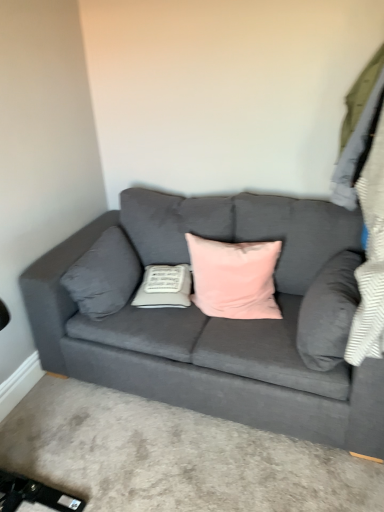
Question: Considering the relative positions of gray fabric pillow at left, the 4th pillow viewed from the right, and velvet gray pillow at right, marked as the first pillow in a right-to-left arrangement, in the image provided, is gray fabric pillow at left, the 4th pillow viewed from the right, to the right of velvet gray pillow at right, marked as the first pillow in a right-to-left arrangement, from the viewer's perspective?

Choices:
 (A) no
 (B) yes

Answer: (A)

Question: From a real-world perspective, is gray fabric pillow at left, the 4th pillow viewed from the right, positioned under velvet gray pillow at right, marked as the first pillow in a right-to-left arrangement, based on gravity?

Choices:
 (A) no
 (B) yes

Answer: (B)

Question: Considering the relative sizes of gray fabric pillow at left, the 4th pillow viewed from the right, and velvet gray pillow at right, the fourth pillow from the left, in the image provided, is gray fabric pillow at left, the 4th pillow viewed from the right, shorter than velvet gray pillow at right, the fourth pillow from the left,?

Choices:
 (A) yes
 (B) no

Answer: (A)

Question: From a real-world perspective, is gray fabric pillow at left, the 4th pillow viewed from the right, over velvet gray pillow at right, the fourth pillow from the left?

Choices:
 (A) no
 (B) yes

Answer: (A)

Question: From the image's perspective, does gray fabric pillow at left, marked as the 1th pillow in a left-to-right arrangement, appear higher than velvet gray pillow at right, marked as the first pillow in a right-to-left arrangement?

Choices:
 (A) no
 (B) yes

Answer: (B)

Question: In terms of width, does velvet gray pillow at right, the fourth pillow from the left, look wider or thinner when compared to velvet gray couch at center?

Choices:
 (A) thin
 (B) wide

Answer: (A)

Question: Considering the relative positions of velvet gray pillow at right, marked as the first pillow in a right-to-left arrangement, and velvet gray couch at center in the image provided, is velvet gray pillow at right, marked as the first pillow in a right-to-left arrangement, to the left or to the right of velvet gray couch at center?

Choices:
 (A) left
 (B) right

Answer: (B)

Question: From their relative heights in the image, would you say velvet gray pillow at right, the fourth pillow from the left, is taller or shorter than velvet gray couch at center?

Choices:
 (A) short
 (B) tall

Answer: (A)

Question: Based on their sizes in the image, would you say velvet gray pillow at right, the fourth pillow from the left, is bigger or smaller than velvet gray couch at center?

Choices:
 (A) small
 (B) big

Answer: (A)

Question: Is velvet gray couch at center spatially inside velvet gray pillow at right, marked as the first pillow in a right-to-left arrangement, or outside of it?

Choices:
 (A) inside
 (B) outside

Answer: (B)

Question: From the image's perspective, is velvet gray couch at center located above or below velvet gray pillow at right, the fourth pillow from the left?

Choices:
 (A) above
 (B) below

Answer: (A)

Question: Is velvet gray couch at center to the left or to the right of velvet gray pillow at right, marked as the first pillow in a right-to-left arrangement, in the image?

Choices:
 (A) right
 (B) left

Answer: (B)

Question: Relative to velvet gray pillow at right, marked as the first pillow in a right-to-left arrangement, is velvet gray couch at center in front or behind?

Choices:
 (A) behind
 (B) front

Answer: (B)

Question: In terms of size, does gray fabric pillow at left, the 4th pillow viewed from the right, appear bigger or smaller than pink velvet pillow at center, placed as the 2th pillow when sorted from right to left?

Choices:
 (A) small
 (B) big

Answer: (A)

Question: From a real-world perspective, relative to pink velvet pillow at center, placed as the 2th pillow when sorted from right to left, is gray fabric pillow at left, marked as the 1th pillow in a left-to-right arrangement, vertically above or below?

Choices:
 (A) above
 (B) below

Answer: (B)